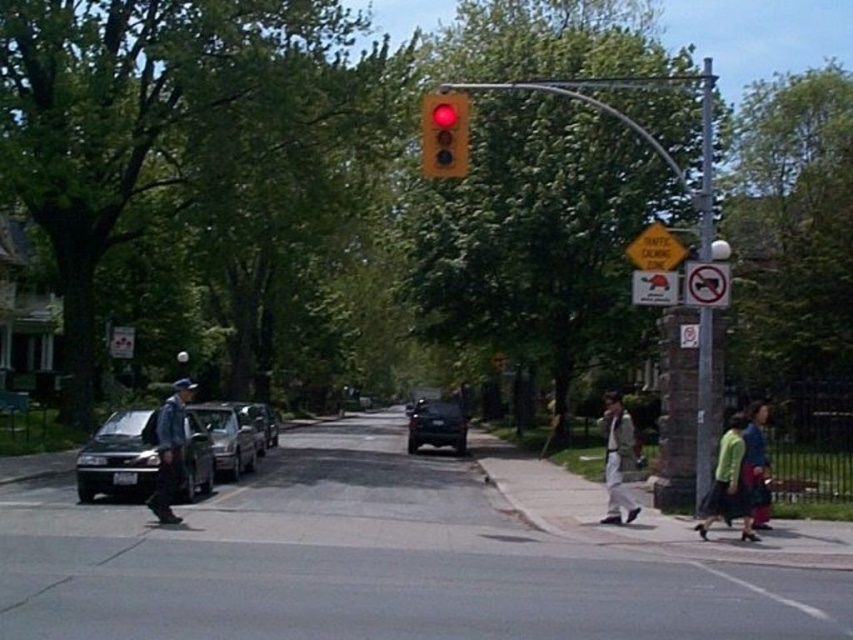
Question: Is green fabric skirt at lower right closer to the viewer compared to white plastic sign at upper right?

Choices:
 (A) yes
 (B) no

Answer: (A)

Question: Among these points, which one is nearest to the camera?

Choices:
 (A) (723, 289)
 (B) (628, 436)
 (C) (239, 433)
 (D) (643, 230)

Answer: (A)

Question: Which of the following is the farthest from the observer?

Choices:
 (A) white plastic sign at upper right
 (B) denim jacket at left
 (C) gray asphalt road at center

Answer: (A)

Question: Can you confirm if gray asphalt road at center is positioned to the left of light brown leather jacket at lower right?

Choices:
 (A) yes
 (B) no

Answer: (A)

Question: Is green fabric skirt at lower right to the left of yellow reflective plastic traffic calming sign at upper center from the viewer's perspective?

Choices:
 (A) yes
 (B) no

Answer: (A)

Question: Which is nearer to the green fabric skirt at lower right?

Choices:
 (A) yellow reflective plastic traffic calming sign at upper center
 (B) white plastic sign at upper right
 (C) light brown leather jacket at lower right
 (D) denim jacket at left

Answer: (C)